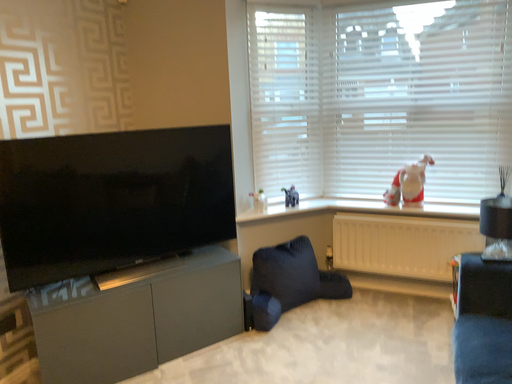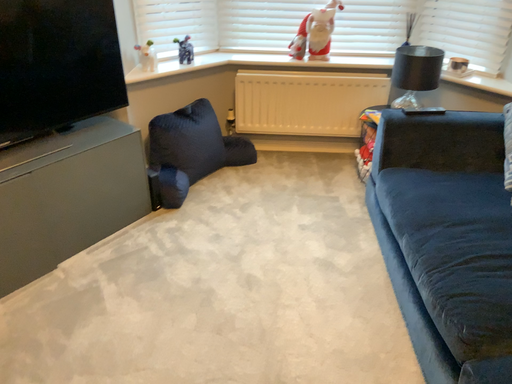
Question: How did the camera likely rotate when shooting the video?

Choices:
 (A) rotated downward
 (B) rotated upward

Answer: (A)